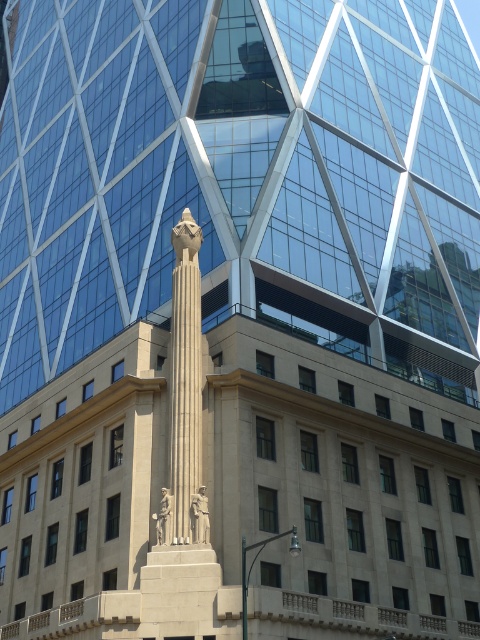
You are standing at the point marked by the coordinates point (186, 380) in the image. Which object are you closest to?

You are closest to the white marble column at center because the coordinates point (186, 380) corresponds to it.

You are an architect designing a new sculpture garden. You have two statues to place in the center of the garden. The stone statue at center and the polished bronze statue at center. Which statue should you choose if you want to minimize the space it takes up?

You should choose the stone statue at center because it occupies less space than the polished bronze statue at center.

You are standing at a safe distance from the white marble column at center. If the recommended safe distance for viewing the column is 120 feet, are you within the recommended range?

The distance between you and the white marble column at center is 132.39 feet, which exceeds the recommended safe distance of 120 feet. Therefore, you are outside the recommended range.